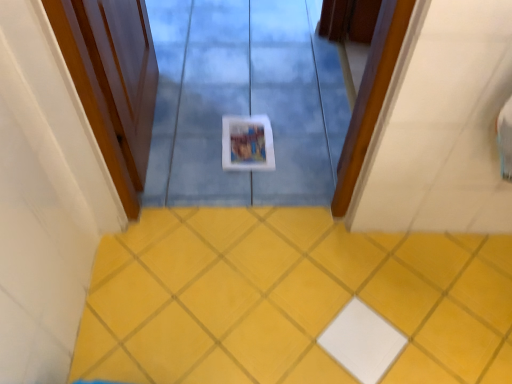
Where is `yellow matte tile at center`? The height and width of the screenshot is (384, 512). yellow matte tile at center is located at coordinates (289, 299).

Describe the element at coordinates (289, 299) in the screenshot. Image resolution: width=512 pixels, height=384 pixels. I see `yellow matte tile at center` at that location.

This screenshot has width=512, height=384. What do you see at coordinates (111, 87) in the screenshot? I see `wooden door at left` at bounding box center [111, 87].

What is the approximate width of wooden door at left?

wooden door at left is 3.97 inches wide.

This screenshot has width=512, height=384. Find the location of `wooden door at left`. wooden door at left is located at coordinates (111, 87).

This screenshot has height=384, width=512. I want to click on yellow matte tile at center, so click(x=289, y=299).

Does yellow matte tile at center appear on the right side of wooden door at left?

Yes, yellow matte tile at center is to the right of wooden door at left.

Is the position of yellow matte tile at center less distant than that of wooden door at left?

No, yellow matte tile at center is behind wooden door at left.

Which point is more distant from viewer, [481,246] or [102,78]?

Positioned behind is point [481,246].

From the image's perspective, is yellow matte tile at center above wooden door at left?

No, from the image's perspective, yellow matte tile at center is not above wooden door at left.

From a real-world perspective, is yellow matte tile at center under wooden door at left?

Correct, in the physical world, yellow matte tile at center is lower than wooden door at left.

Considering the sizes of yellow matte tile at center and wooden door at left in the image, is yellow matte tile at center wider or thinner than wooden door at left?

Considering their sizes, yellow matte tile at center looks broader than wooden door at left.

In the scene shown: Is yellow matte tile at center shorter than wooden door at left?

Correct, yellow matte tile at center is not as tall as wooden door at left.

Can you confirm if yellow matte tile at center is smaller than wooden door at left?

Indeed, yellow matte tile at center has a smaller size compared to wooden door at left.

Is wooden door at left surrounded by yellow matte tile at center?

Definitely not — wooden door at left is not inside yellow matte tile at center.

In the scene shown: Is yellow matte tile at center touching wooden door at left?

No, yellow matte tile at center is not making contact with wooden door at left.

Is yellow matte tile at center positioned with its back to wooden door at left?

No, yellow matte tile at center is not facing away from wooden door at left.

What's the angular difference between yellow matte tile at center and wooden door at left's facing directions?

They differ by 87.4 degrees in their facing directions.

Image resolution: width=512 pixels, height=384 pixels. What are the coordinates of `door lying on the left of yellow matte tile at center` in the screenshot? It's located at (111, 87).

Is wooden door at left at the left side of yellow matte tile at center?

Yes, wooden door at left is to the left of yellow matte tile at center.

Does wooden door at left lie in front of yellow matte tile at center?

Yes.

Is point (122, 75) closer or farther from the camera than point (305, 281)?

Point (122, 75) appears to be closer to the viewer than point (305, 281).

From the image's perspective, is wooden door at left on yellow matte tile at center?

Yes, from the image's perspective, wooden door at left is over yellow matte tile at center.

From a real-world perspective, is wooden door at left positioned above or below yellow matte tile at center?

In terms of real-world spatial position, wooden door at left is above yellow matte tile at center.

Between wooden door at left and yellow matte tile at center, which one has larger width?

yellow matte tile at center is wider.

Is wooden door at left shorter than yellow matte tile at center?

Incorrect, the height of wooden door at left does not fall short of that of yellow matte tile at center.

Which of these two, wooden door at left or yellow matte tile at center, is bigger?

With larger size is wooden door at left.

Would you say wooden door at left is outside yellow matte tile at center?

Yes.

Is wooden door at left in contact with yellow matte tile at center?

No, wooden door at left is not touching yellow matte tile at center.

Could you tell me if wooden door at left is turned towards yellow matte tile at center?

No, wooden door at left is not oriented towards yellow matte tile at center.

How far apart are wooden door at left and yellow matte tile at center?

The distance of wooden door at left from yellow matte tile at center is 23.64 inches.

Where is `door in front of the yellow matte tile at center`? door in front of the yellow matte tile at center is located at coordinates (111, 87).

The height and width of the screenshot is (384, 512). Identify the location of door positioned vertically above the yellow matte tile at center (from a real-world perspective). (111, 87).

The height and width of the screenshot is (384, 512). Identify the location of ceramic tile on the right of wooden door at left. (289, 299).